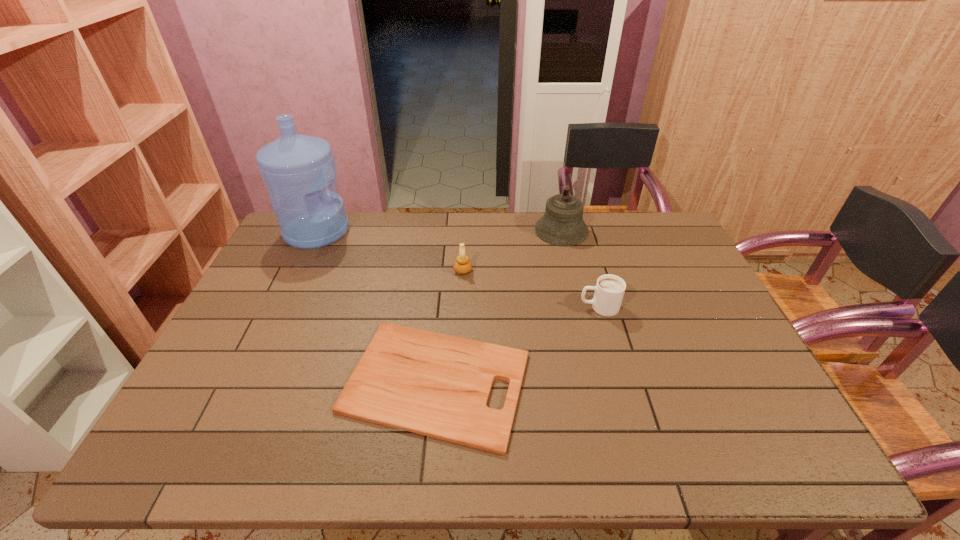
The height and width of the screenshot is (540, 960). I want to click on free spot that satisfies the following two spatial constraints: 1. on the side of the tallest object with the handle; 2. on the right side of the chopping board, so click(x=244, y=382).

Locate an element on the screen. Image resolution: width=960 pixels, height=540 pixels. vacant area in the image that satisfies the following two spatial constraints: 1. on the side of the leftmost object with the handle; 2. on the left side of the third nearest object is located at coordinates (298, 271).